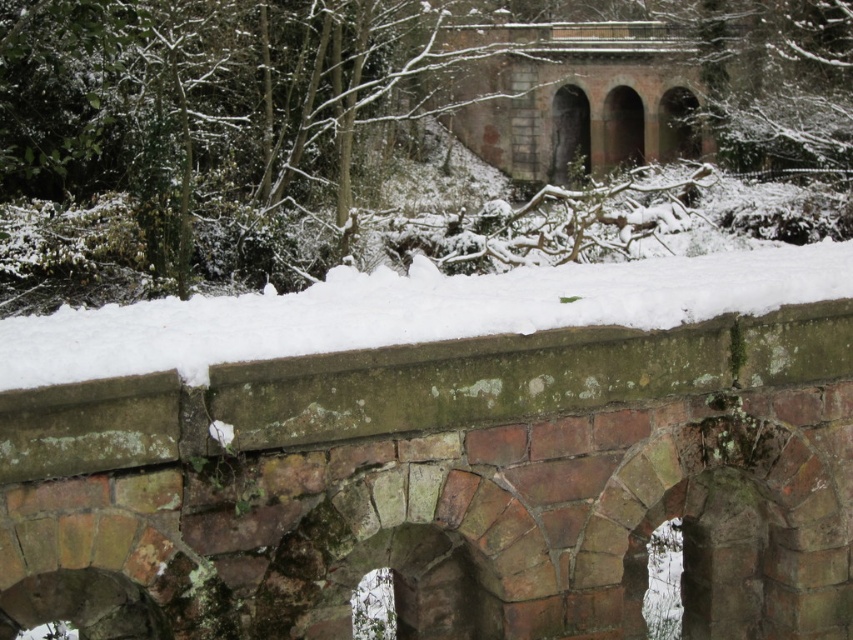
Does green leafy tree at center have a larger size compared to white powdery snow at center?

Yes.

Does green leafy tree at center appear over white powdery snow at center?

Yes.

Between point (108, 106) and point (544, 317), which one is positioned in front?

Point (544, 317)

The height and width of the screenshot is (640, 853). I want to click on green leafy tree at center, so click(x=384, y=124).